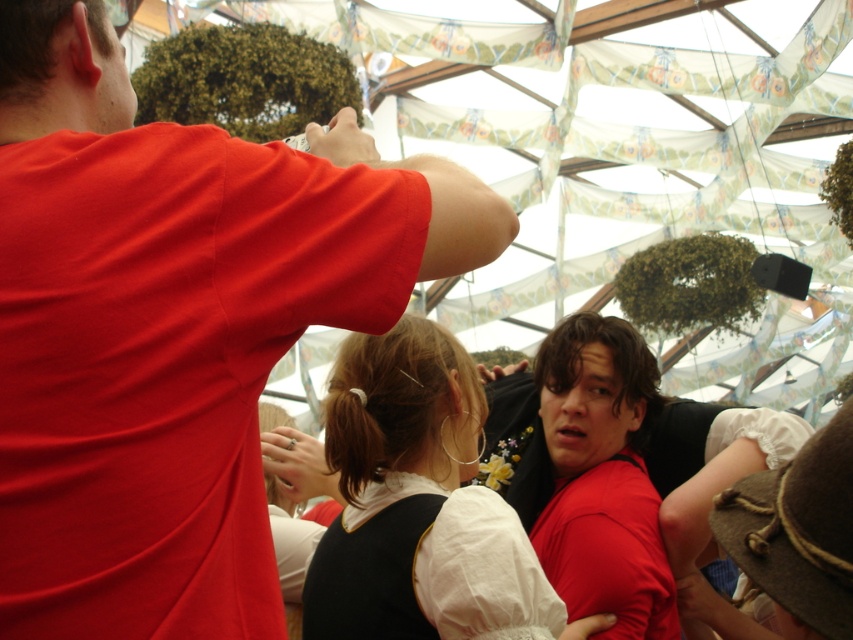
You are a photographer at the event and want to ensure both the matte red shirt at upper left and the matte black dress at center are clearly visible in your photo. Based on their positions, which one is closer to the camera?

The matte red shirt at upper left is in front of the matte black dress at center, so it is closer to the camera and will appear more prominent in the photo.

You are a photographer trying to capture the scene under the tent. You notice two people at the center wearing the matte red shirt at center and the matte white blouse at center. Which clothing item is covering part of the other?

The matte red shirt at center is positioned over the matte white blouse at center, so it is covering part of it.